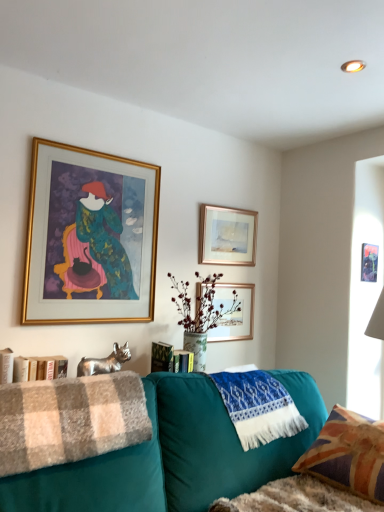
Describe the element at coordinates (227, 236) in the screenshot. I see `gold-framed picture at upper center, which is counted as the third picture frame, starting from the left` at that location.

The height and width of the screenshot is (512, 384). I want to click on union jack fabric pillow at lower right, so click(348, 455).

Measure the distance between plush beige checkered blanket at lower left and camera.

plush beige checkered blanket at lower left is 1.28 meters from camera.

Measure the distance between point (x=301, y=401) and camera.

Point (x=301, y=401) is 2.05 meters from camera.

Describe the element at coordinates (173, 455) in the screenshot. I see `teal fabric couch at lower right` at that location.

Describe the element at coordinates (90, 237) in the screenshot. The width and height of the screenshot is (384, 512). I see `gold-framed artwork at upper left, placed as the 4th picture frame when sorted from right to left` at that location.

What do you see at coordinates (234, 313) in the screenshot? The height and width of the screenshot is (512, 384). I see `gold-framed picture at upper center, which is counted as the third picture frame, starting from the right` at bounding box center [234, 313].

What are the coordinates of `gold-framed picture at upper center, which is the 2th picture frame in right-to-left order` in the screenshot? It's located at (227, 236).

Is teal fabric couch at lower right smaller than plush beige checkered blanket at lower left?

No, teal fabric couch at lower right is not smaller than plush beige checkered blanket at lower left.

Is teal fabric couch at lower right positioned with its back to plush beige checkered blanket at lower left?

Correct, teal fabric couch at lower right is looking away from plush beige checkered blanket at lower left.

Considering the points (33, 486) and (81, 455), which point is in front, point (33, 486) or point (81, 455)?

Point (33, 486)

From the image's perspective, which is above, teal fabric couch at lower right or plush beige checkered blanket at lower left?

plush beige checkered blanket at lower left, from the image's perspective.

From a real-world perspective, relative to gold-framed artwork at upper left, placed as the 4th picture frame when sorted from right to left, is teal fabric couch at lower right vertically above or below?

teal fabric couch at lower right is below gold-framed artwork at upper left, placed as the 4th picture frame when sorted from right to left.

Is teal fabric couch at lower right not within gold-framed artwork at upper left, the 1th picture frame when ordered from left to right?

teal fabric couch at lower right lies outside gold-framed artwork at upper left, the 1th picture frame when ordered from left to right,'s area.

Can you tell me how much teal fabric couch at lower right and gold-framed artwork at upper left, placed as the 4th picture frame when sorted from right to left, differ in facing direction?

0.143 degrees.

In the image, is blue knitted blanket at lower center positioned in front of or behind union jack fabric pillow at lower right?

Visually, blue knitted blanket at lower center is located behind union jack fabric pillow at lower right.

Looking at their sizes, would you say blue knitted blanket at lower center is wider or thinner than union jack fabric pillow at lower right?

Clearly, blue knitted blanket at lower center has less width compared to union jack fabric pillow at lower right.

Do you think blue knitted blanket at lower center is within union jack fabric pillow at lower right, or outside of it?

blue knitted blanket at lower center lies outside union jack fabric pillow at lower right.

From a real-world perspective, which object rests below the other?

union jack fabric pillow at lower right, from a real-world perspective.

Is union jack fabric pillow at lower right outside of gold-framed picture at upper center, which ranks as the 2th picture frame in left-to-right order?

Indeed, union jack fabric pillow at lower right is completely outside gold-framed picture at upper center, which ranks as the 2th picture frame in left-to-right order.

From a real-world perspective, who is located higher, union jack fabric pillow at lower right or gold-framed picture at upper center, which ranks as the 2th picture frame in left-to-right order?

In real-world perspective, gold-framed picture at upper center, which ranks as the 2th picture frame in left-to-right order, is above.

Based on the photo, which object is thinner, union jack fabric pillow at lower right or gold-framed picture at upper center, which is counted as the third picture frame, starting from the right?

gold-framed picture at upper center, which is counted as the third picture frame, starting from the right.

From the image's perspective, which object appears higher, union jack fabric pillow at lower right or gold-framed picture at upper center, which ranks as the 2th picture frame in left-to-right order?

gold-framed picture at upper center, which ranks as the 2th picture frame in left-to-right order, appears higher in the image.

Is gold-framed artwork at upper left, placed as the 4th picture frame when sorted from right to left, aimed at teal fabric couch at lower right?

No.

Is gold-framed artwork at upper left, the 1th picture frame when ordered from left to right, thinner than teal fabric couch at lower right?

Correct, the width of gold-framed artwork at upper left, the 1th picture frame when ordered from left to right, is less than that of teal fabric couch at lower right.

From the picture: Is teal fabric couch at lower right surrounded by gold-framed artwork at upper left, placed as the 4th picture frame when sorted from right to left?

No, gold-framed artwork at upper left, placed as the 4th picture frame when sorted from right to left, does not contain teal fabric couch at lower right.

Is point (235, 340) closer to camera compared to point (364, 480)?

That is False.

Consider the image. Who is taller, gold-framed picture at upper center, which is counted as the third picture frame, starting from the right, or union jack fabric pillow at lower right?

With more height is union jack fabric pillow at lower right.

Considering the relative sizes of gold-framed picture at upper center, which ranks as the 2th picture frame in left-to-right order, and union jack fabric pillow at lower right in the image provided, is gold-framed picture at upper center, which ranks as the 2th picture frame in left-to-right order, smaller than union jack fabric pillow at lower right?

Yes.

Which is more to the right, gold-framed picture at upper center, which is counted as the third picture frame, starting from the left, or union jack fabric pillow at lower right?

union jack fabric pillow at lower right is more to the right.

Could you tell me if gold-framed picture at upper center, which is the 2th picture frame in right-to-left order, is facing union jack fabric pillow at lower right?

No, gold-framed picture at upper center, which is the 2th picture frame in right-to-left order, does not turn towards union jack fabric pillow at lower right.

Is gold-framed picture at upper center, which is the 2th picture frame in right-to-left order, spatially inside union jack fabric pillow at lower right, or outside of it?

The correct answer is: outside.

Locate an element on the screen. This screenshot has height=512, width=384. blanket behind the teal fabric couch at lower right is located at coordinates (70, 420).

The width and height of the screenshot is (384, 512). Find the location of `studio couch located underneath the gold-framed artwork at upper left, placed as the 4th picture frame when sorted from right to left (from a real-world perspective)`. studio couch located underneath the gold-framed artwork at upper left, placed as the 4th picture frame when sorted from right to left (from a real-world perspective) is located at coordinates (173, 455).

When comparing their distances from gold-framed picture at upper center, which is the 2th picture frame in right-to-left order, does plush beige checkered blanket at lower left or gold-framed artwork at upper left, the 1th picture frame when ordered from left to right, seem further?

plush beige checkered blanket at lower left is further to gold-framed picture at upper center, which is the 2th picture frame in right-to-left order.

From the image, which object appears to be nearer to plush beige checkered blanket at lower left, union jack fabric pillow at lower right or blue knitted blanket at lower center?

The object closer to plush beige checkered blanket at lower left is blue knitted blanket at lower center.

Looking at the image, which one is located further to teal fabric couch at lower right, gold-framed picture at upper center, which is counted as the third picture frame, starting from the left, or metallic gold picture frame at upper center, the first picture frame viewed from the right?

metallic gold picture frame at upper center, the first picture frame viewed from the right, lies further to teal fabric couch at lower right than the other object.

Which object lies nearer to the anchor point gold-framed picture at upper center, which is the 2th picture frame in right-to-left order, gold-framed picture at upper center, which is counted as the third picture frame, starting from the right, or metallic gold picture frame at upper center, the first picture frame viewed from the right?

gold-framed picture at upper center, which is counted as the third picture frame, starting from the right, lies closer to gold-framed picture at upper center, which is the 2th picture frame in right-to-left order, than the other object.

When comparing their distances from plush beige checkered blanket at lower left, does gold-framed artwork at upper left, the 1th picture frame when ordered from left to right, or union jack fabric pillow at lower right seem closer?

The object closer to plush beige checkered blanket at lower left is gold-framed artwork at upper left, the 1th picture frame when ordered from left to right.

Which object lies further to the anchor point plush beige checkered blanket at lower left, teal fabric couch at lower right or gold-framed picture at upper center, which is counted as the third picture frame, starting from the left?

Based on the image, gold-framed picture at upper center, which is counted as the third picture frame, starting from the left, appears to be further to plush beige checkered blanket at lower left.

Considering their positions, is union jack fabric pillow at lower right positioned further to gold-framed artwork at upper left, placed as the 4th picture frame when sorted from right to left, than teal fabric couch at lower right?

union jack fabric pillow at lower right is positioned further to the anchor gold-framed artwork at upper left, placed as the 4th picture frame when sorted from right to left.

Estimate the real-world distances between objects in this image. Which object is further from gold-framed artwork at upper left, the 1th picture frame when ordered from left to right, plush beige checkered blanket at lower left or union jack fabric pillow at lower right?

union jack fabric pillow at lower right is further to gold-framed artwork at upper left, the 1th picture frame when ordered from left to right.

Image resolution: width=384 pixels, height=512 pixels. What are the coordinates of `pillow between plush beige checkered blanket at lower left and gold-framed picture at upper center, which ranks as the 2th picture frame in left-to-right order, along the z-axis` in the screenshot? It's located at (348, 455).

The height and width of the screenshot is (512, 384). I want to click on picture frame positioned between teal fabric couch at lower right and gold-framed picture at upper center, which ranks as the 2th picture frame in left-to-right order, from near to far, so click(90, 237).

You are a GUI agent. You are given a task and a screenshot of the screen. Output one action in this format:
    pyautogui.click(x=<x>, y=<y>)
    Task: Click on the pillow between teal fabric couch at lower right and blue knitted blanket at lower center in the front-back direction
    The height and width of the screenshot is (512, 384).
    Given the screenshot: What is the action you would take?
    pyautogui.click(x=348, y=455)

Find the location of a particular element. The image size is (384, 512). blanket that lies between gold-framed artwork at upper left, the 1th picture frame when ordered from left to right, and blue knitted blanket at lower center from top to bottom is located at coordinates (70, 420).